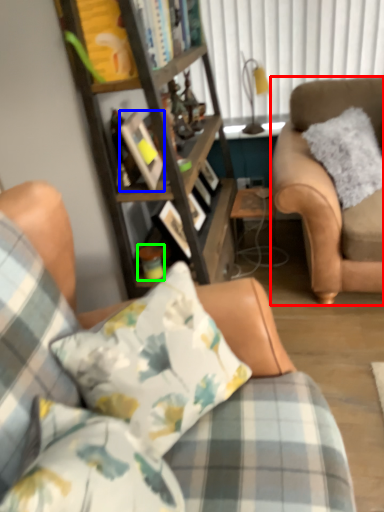
Question: Estimate the real-world distances between objects in this image. Which object is farther from chair (highlighted by a red box), picture frame (highlighted by a blue box) or coffee cup (highlighted by a green box)?

Choices:
 (A) picture frame
 (B) coffee cup

Answer: (B)